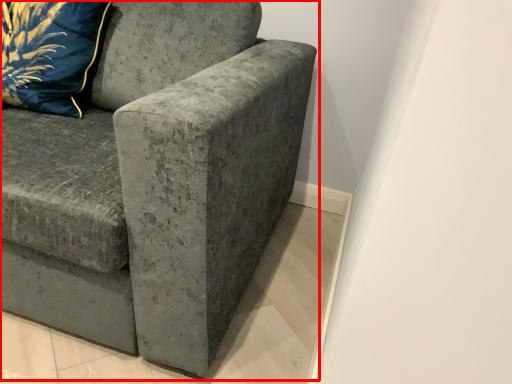
Question: Where is studio couch (annotated by the red box) located in relation to pillow in the image?

Choices:
 (A) left
 (B) right

Answer: (B)